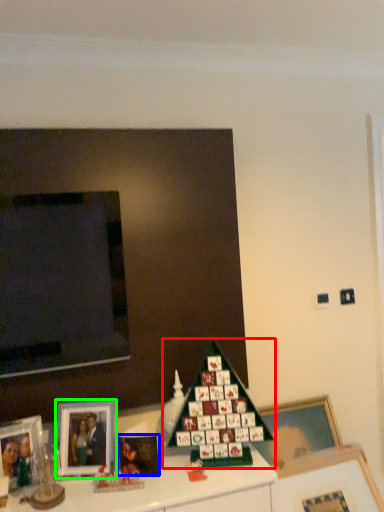
Question: Based on their relative distances, which object is farther from christmas tree (highlighted by a red box)? Choose from picture frame (highlighted by a blue box) and picture frame (highlighted by a green box).

Choices:
 (A) picture frame
 (B) picture frame

Answer: (B)